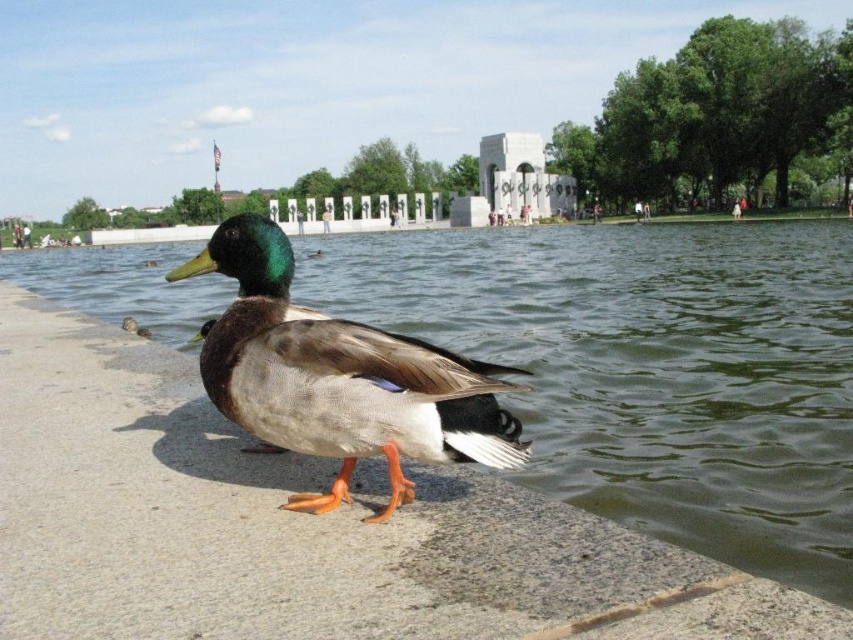
You are a photographer trying to capture the green matte duck at center and the greenish water at lower left in a single shot. Based on their heights, which one would appear larger in the photo?

The greenish water at lower left appears larger in the photo because it has a greater height compared to the green matte duck at center.

You are standing at the point marked by coordinates (648, 369) in the park scene. What is located at this point?

The point at coordinates (648, 369) indicates greenish water at lower left.